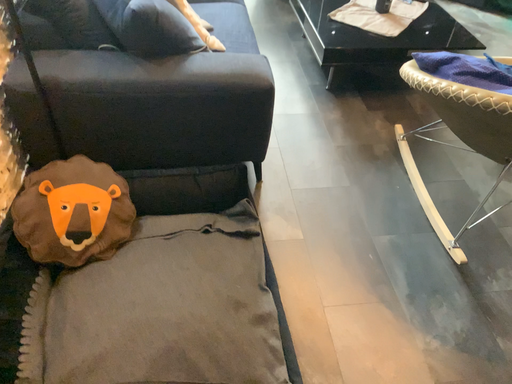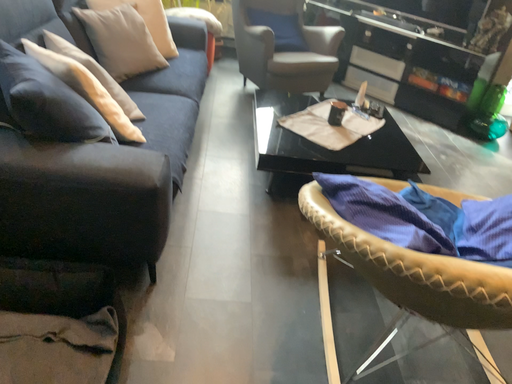
Question: How did the camera likely rotate when shooting the video?

Choices:
 (A) rotated upward
 (B) rotated downward

Answer: (A)